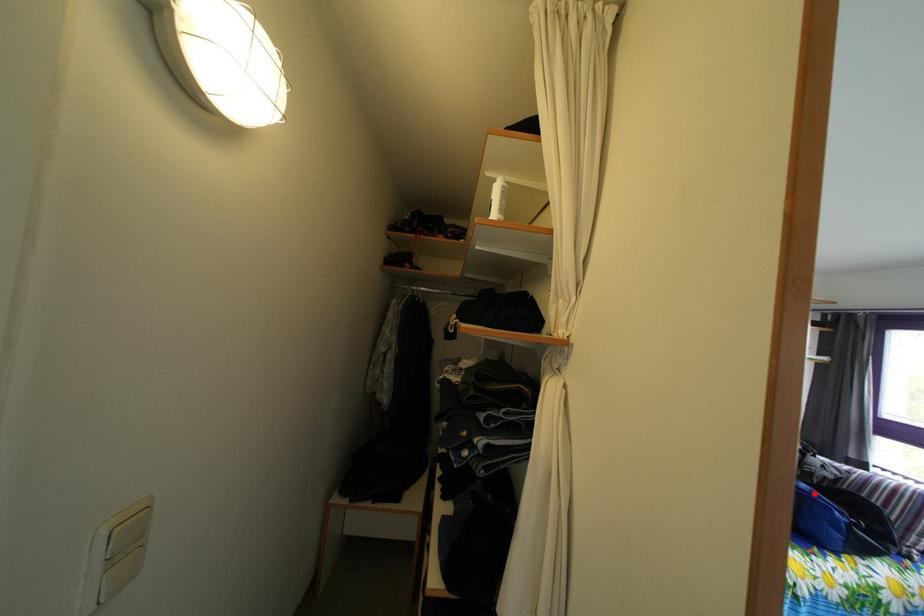
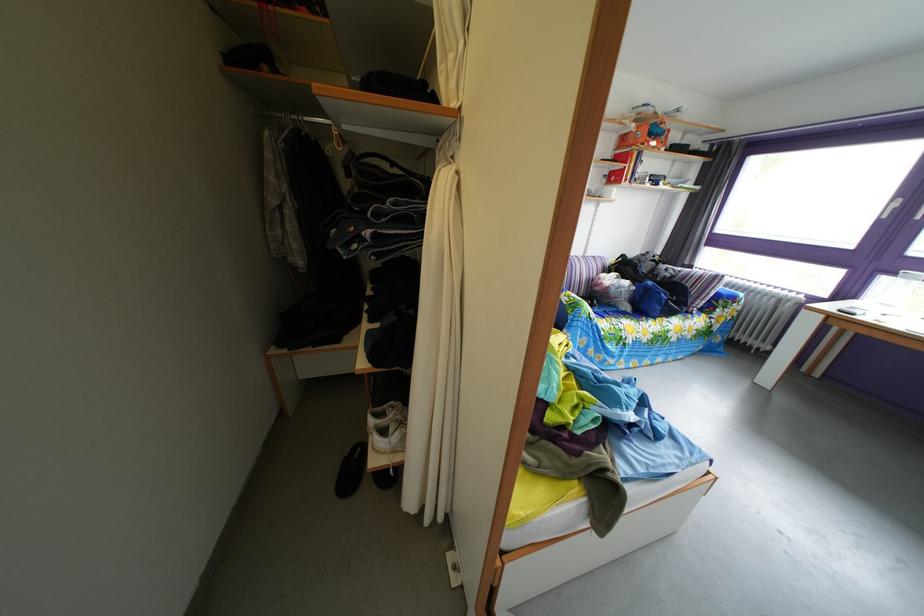
Question: I am providing you with two images of the same scene from different viewpoints. Image1 has a red point marked. In image2, the corresponding 3D location appears at what relative position? Reply with the corresponding letter.

Choices:
 (A) Closer
 (B) Farther

Answer: (B)